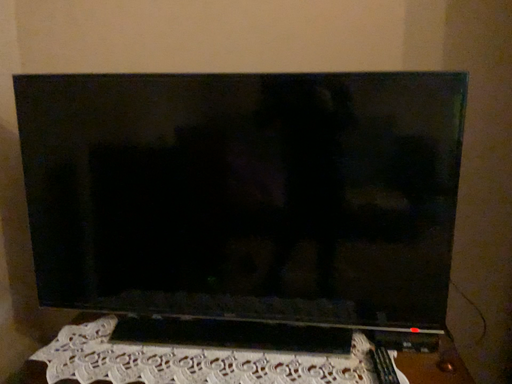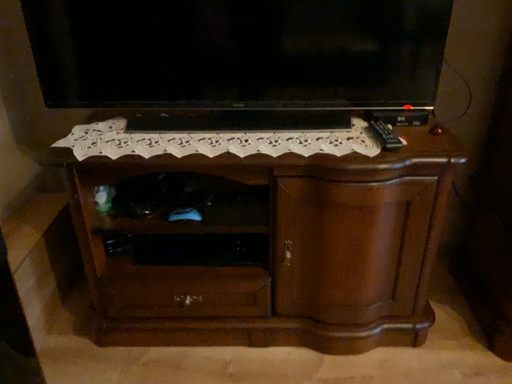
Question: Which way did the camera rotate in the video?

Choices:
 (A) rotated downward
 (B) rotated upward

Answer: (A)